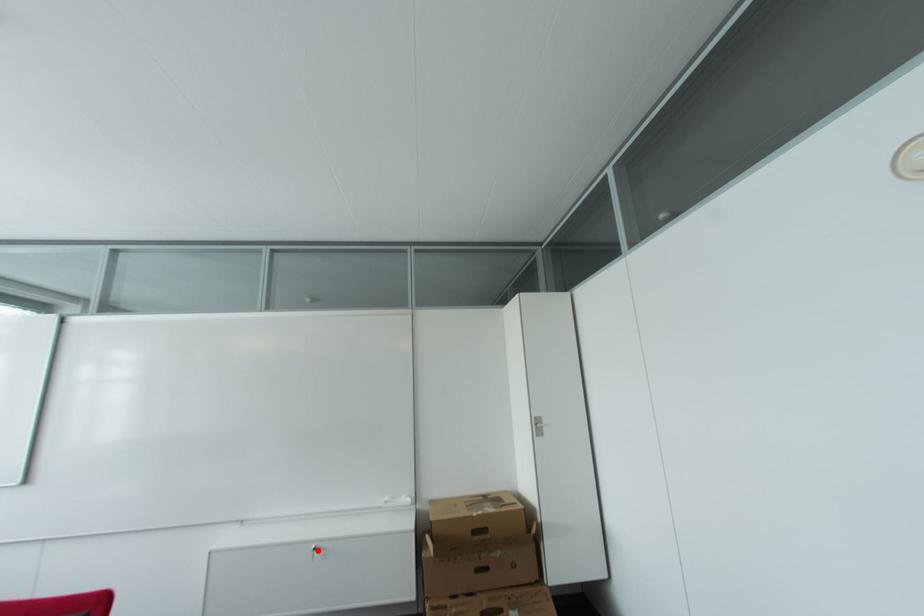
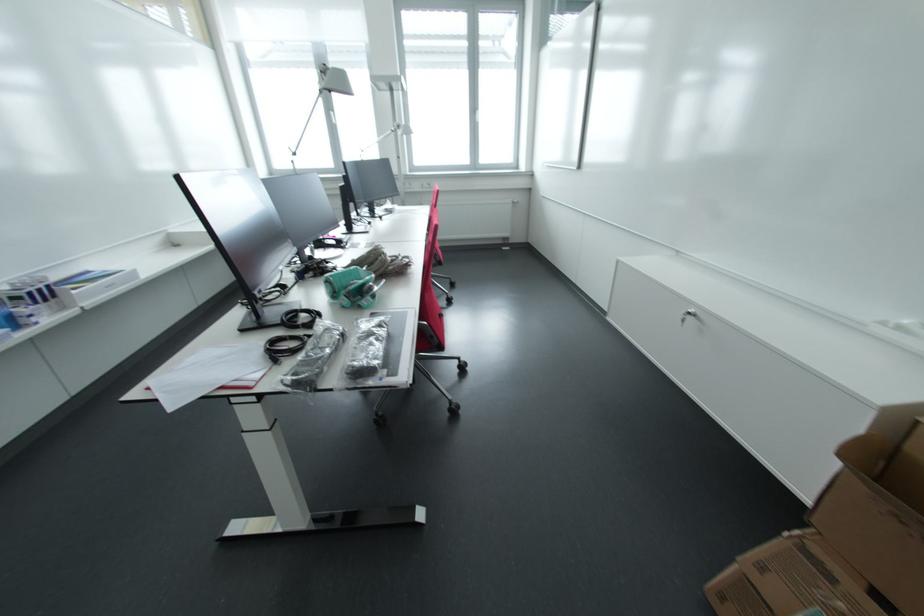
Where in the second image is the point corresponding to the highlighted location from the first image?

(694, 315)